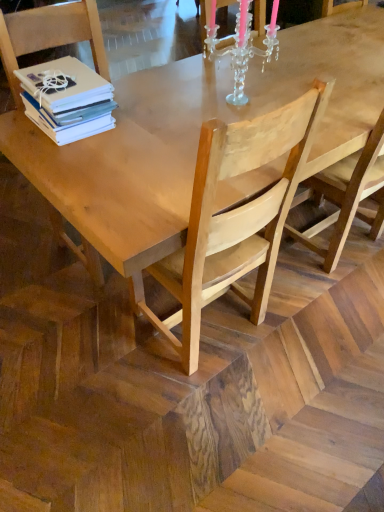
Where is `vacant area that lies between white matte stack of books at upper left and clear crystal candle holder at upper center`? vacant area that lies between white matte stack of books at upper left and clear crystal candle holder at upper center is located at coordinates (154, 113).